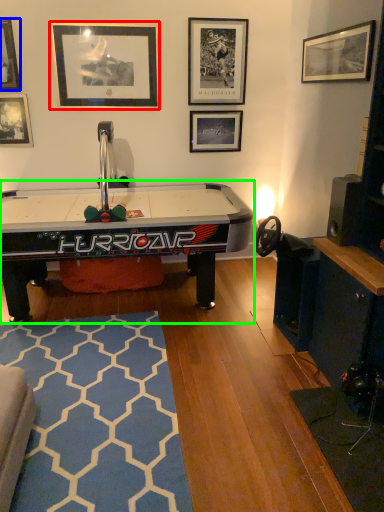
Question: Which object is positioned closest to picture frame (highlighted by a red box)? Select from picture frame (highlighted by a blue box) and table (highlighted by a green box).

Choices:
 (A) picture frame
 (B) table

Answer: (A)